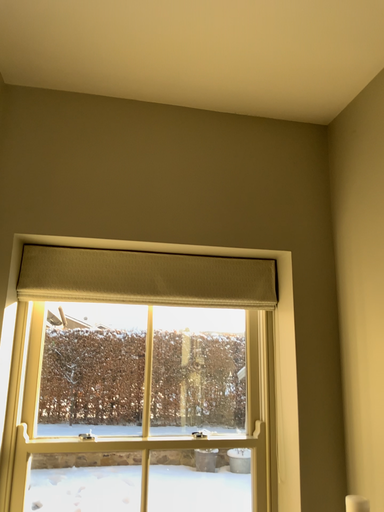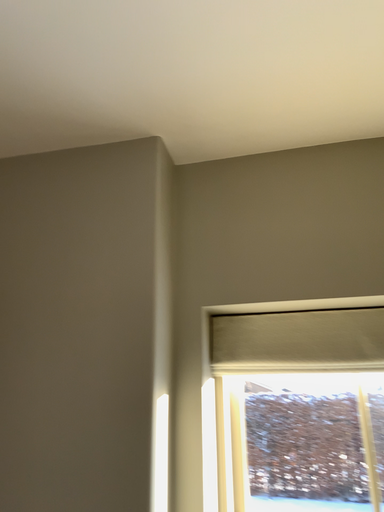
Question: Which way did the camera rotate in the video?

Choices:
 (A) rotated upward
 (B) rotated downward

Answer: (A)